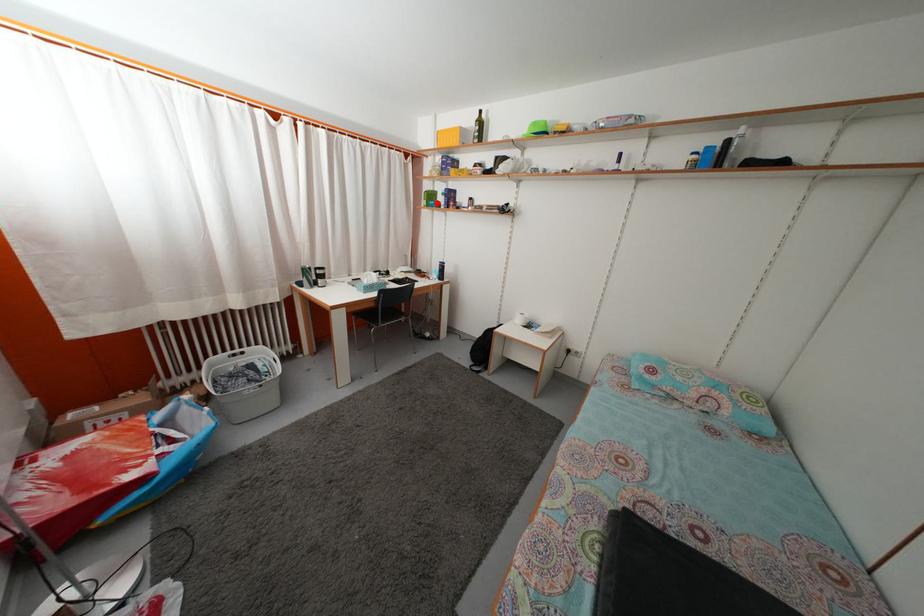
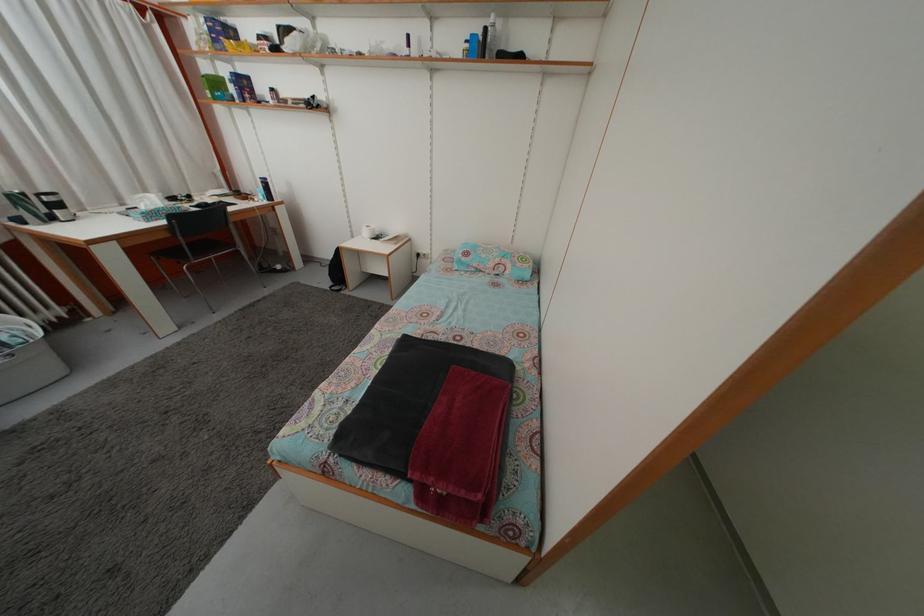
Question: I am providing you with two images of the same scene from different viewpoints. Image1 has a red point marked. In image2, the corresponding 3D location appears at what relative position? Reply with the corresponding letter.

Choices:
 (A) Closer
 (B) Farther

Answer: (B)